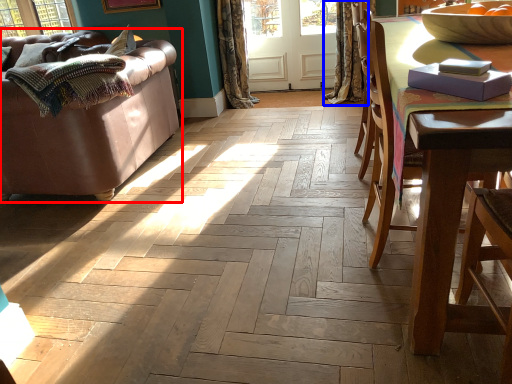
Question: Which object is further to the camera taking this photo, studio couch (highlighted by a red box) or curtain (highlighted by a blue box)?

Choices:
 (A) studio couch
 (B) curtain

Answer: (B)